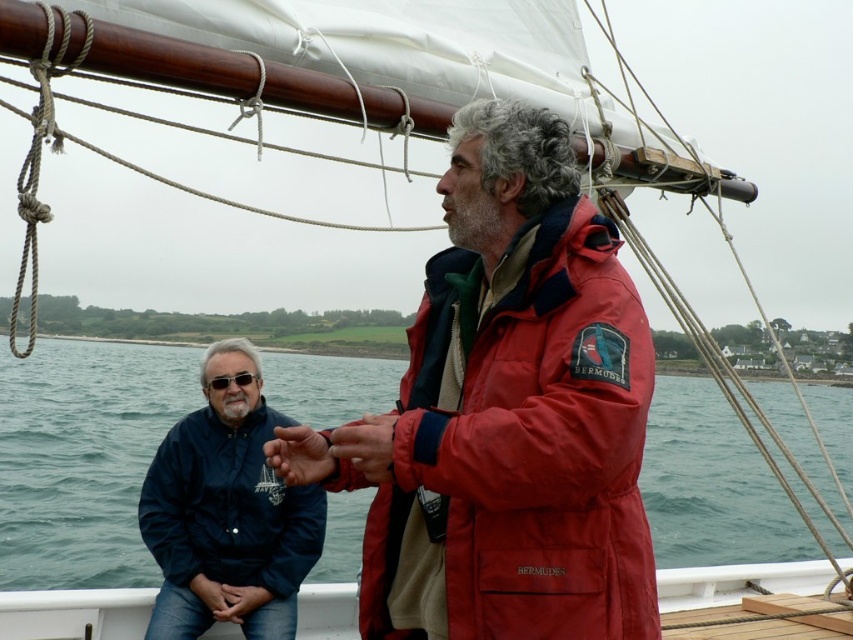
Question: Which point appears closest to the camera in this image?

Choices:
 (A) (355, 438)
 (B) (300, 428)
 (C) (206, 529)
 (D) (451, 592)

Answer: (A)

Question: Is red matte jacket at center to the right of smooth skin hand at lower center from the viewer's perspective?

Choices:
 (A) no
 (B) yes

Answer: (B)

Question: Can you confirm if red matte jacket at center is positioned to the left of dark blue jacket at left?

Choices:
 (A) no
 (B) yes

Answer: (A)

Question: Does smooth skin hand at center appear on the right side of smooth skin hand at lower center?

Choices:
 (A) yes
 (B) no

Answer: (A)

Question: Which point is closer to the camera?

Choices:
 (A) smooth skin hand at center
 (B) dark blue jacket at left
 (C) blue water at center
 (D) red nylon jacket at center

Answer: (A)

Question: Which point is farther from the camera taking this photo?

Choices:
 (A) (194, 605)
 (B) (224, 604)
 (C) (699, 481)
 (D) (283, 468)

Answer: (C)